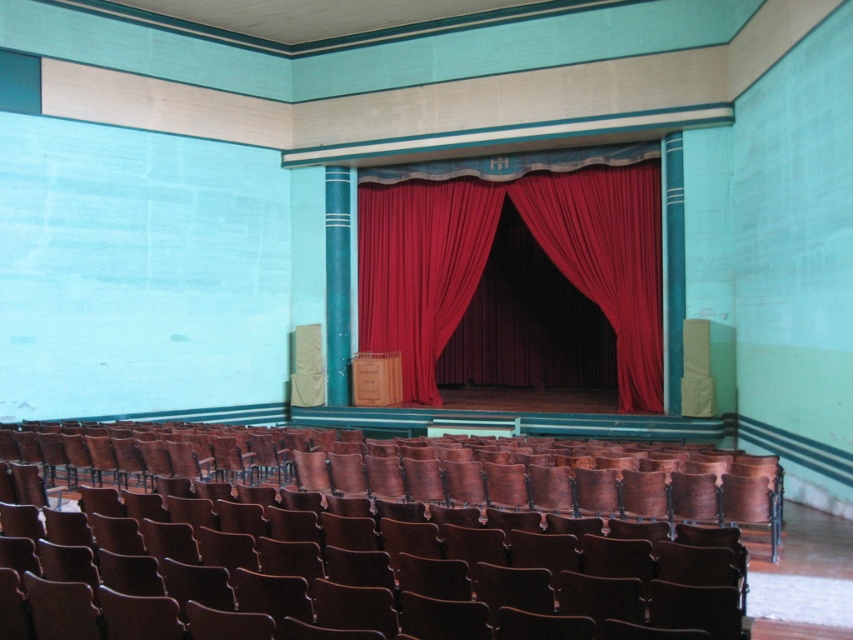
You are attending a play in this theater and need to sit in the wooden polished chair at lower center. Can you see the red velvet curtain at center from your seat?

The wooden polished chair at lower center is shorter than the red velvet curtain at center, so yes, you can see the red velvet curtain at center from the chair.

Based on the photo, you are an event planner setting up for a presentation. You need to place a new table that is 1.2 meters wide in the front area. Given the wooden polished chair at lower center and the red velvet curtain at center, which object might block the view of the curtain if placed between them?

The wooden polished chair at lower center is bigger than the red velvet curtain at center, so placing the table between them might block the view of the red velvet curtain at center due to the chair being larger in size.

You are sitting in the wooden polished chair at lower center and want to look at the red velvet curtain at center. In which direction should you turn your head?

You should turn your head to the left to look at the red velvet curtain at center since the wooden polished chair at lower center is to the right of it.